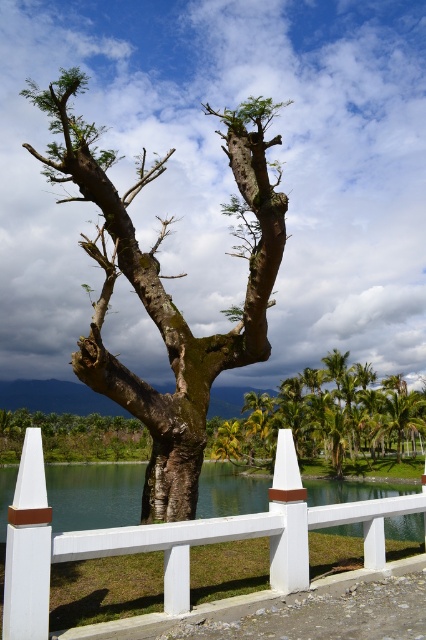
Can you confirm if green mossy bark tree at center is shorter than smooth brown tree trunk at center?

In fact, green mossy bark tree at center may be taller than smooth brown tree trunk at center.

Is green mossy bark tree at center above smooth brown tree trunk at center?

Yes, green mossy bark tree at center is above smooth brown tree trunk at center.

Which is in front, point (104, 259) or point (29, 413)?

Positioned in front is point (104, 259).

Find the location of a particular element. green mossy bark tree at center is located at coordinates (164, 289).

Does point (340, 445) lie behind point (199, 508)?

Yes, point (340, 445) is farther from viewer.

Can you confirm if green mossy tree at center is bigger than clear water at center?

Incorrect, green mossy tree at center is not larger than clear water at center.

Who is more forward, [360,406] or [112,496]?

Point [112,496]

Locate an element on the screen. green mossy tree at center is located at coordinates (331, 420).

Which is below, clear water at center or smooth brown tree trunk at center?

smooth brown tree trunk at center is lower down.

Is clear water at center positioned behind smooth brown tree trunk at center?

That is False.

Identify the location of clear water at center. This screenshot has height=640, width=426. (94, 493).